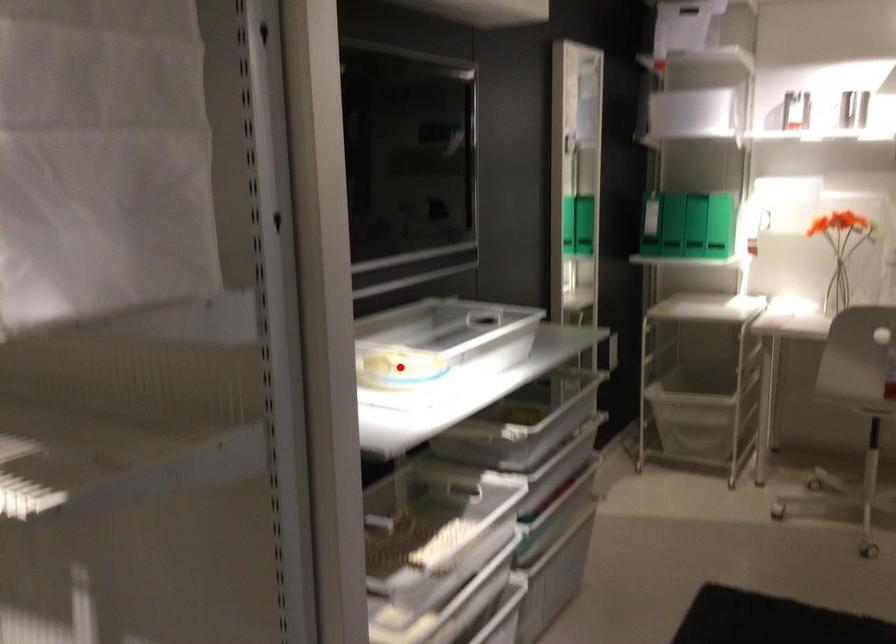
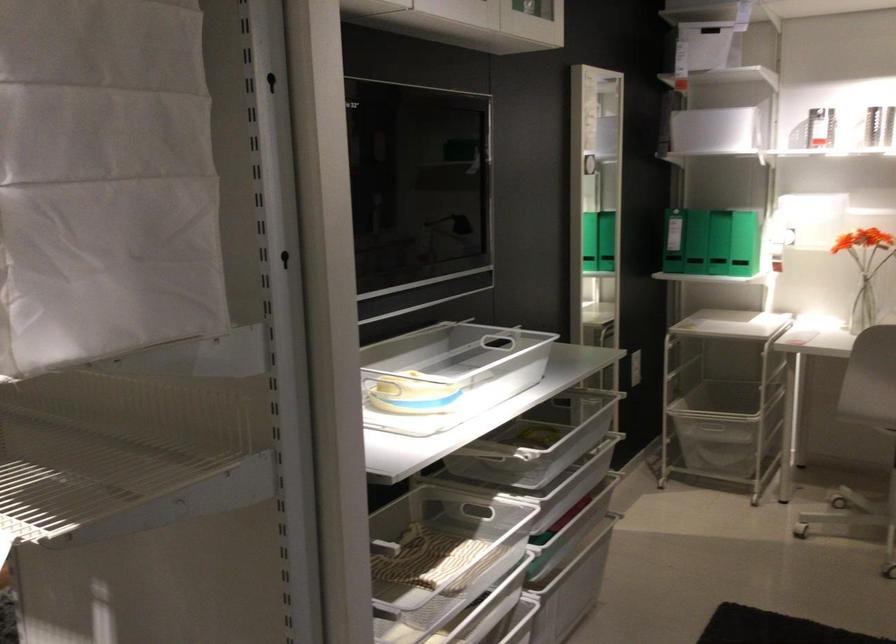
Where in the second image is the point corresponding to the highlighted location from the first image?

(409, 392)